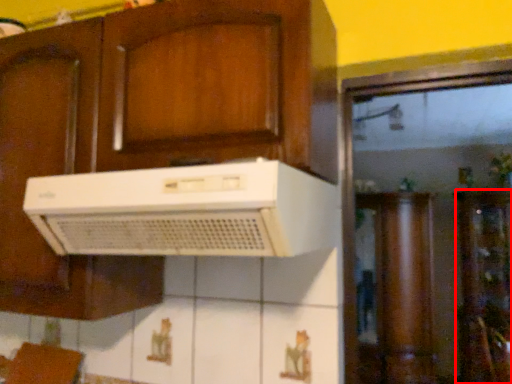
Question: Observing the image, what is the correct spatial positioning of cabinetry (annotated by the red box) in reference to home appliance?

Choices:
 (A) left
 (B) right

Answer: (B)